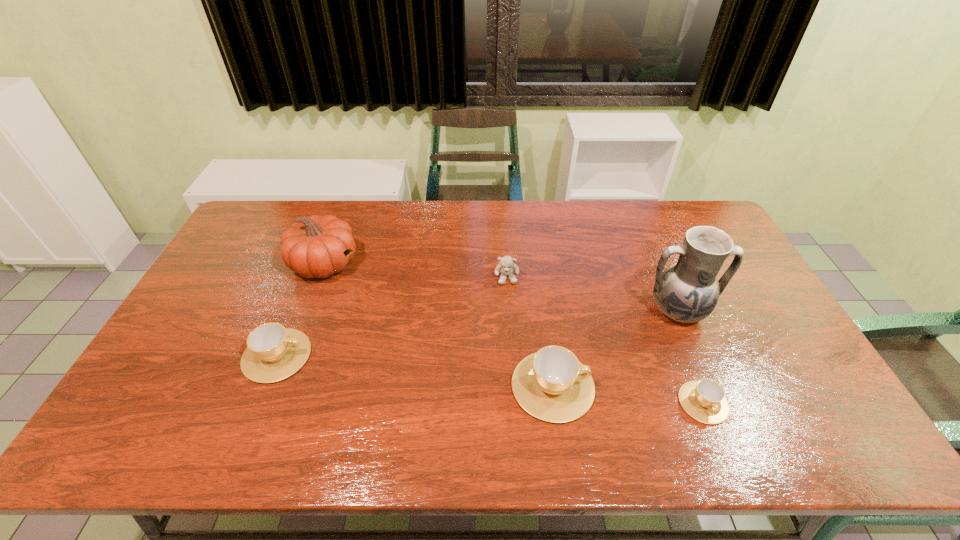
Locate an element on the screen. the second tallest cup is located at coordinates (274, 352).

Find the location of `the second cup from right to left`. the second cup from right to left is located at coordinates [552, 385].

Image resolution: width=960 pixels, height=540 pixels. Find the location of `the shortest cup`. the shortest cup is located at coordinates (704, 400).

At what (x,y) coordinates should I click in order to perform the action: click on the rightmost cup. Please return your answer as a coordinate pair (x, y). The image size is (960, 540). Looking at the image, I should click on (704, 400).

This screenshot has height=540, width=960. In order to click on teddy bear in this screenshot , I will do `click(506, 267)`.

Where is `the tallest object`? The width and height of the screenshot is (960, 540). the tallest object is located at coordinates (687, 291).

Find the location of a particular element. The width and height of the screenshot is (960, 540). the second tallest object is located at coordinates (317, 246).

Where is `blank area located 0.140m with the handle on the side of the leftmost cup`? The image size is (960, 540). blank area located 0.140m with the handle on the side of the leftmost cup is located at coordinates (362, 356).

Identify the location of free location located 0.140m with the handle on the side of the second cup from right to left. (649, 386).

Identify the location of vacant space located 0.220m on the face of the teddy bear. (511, 343).